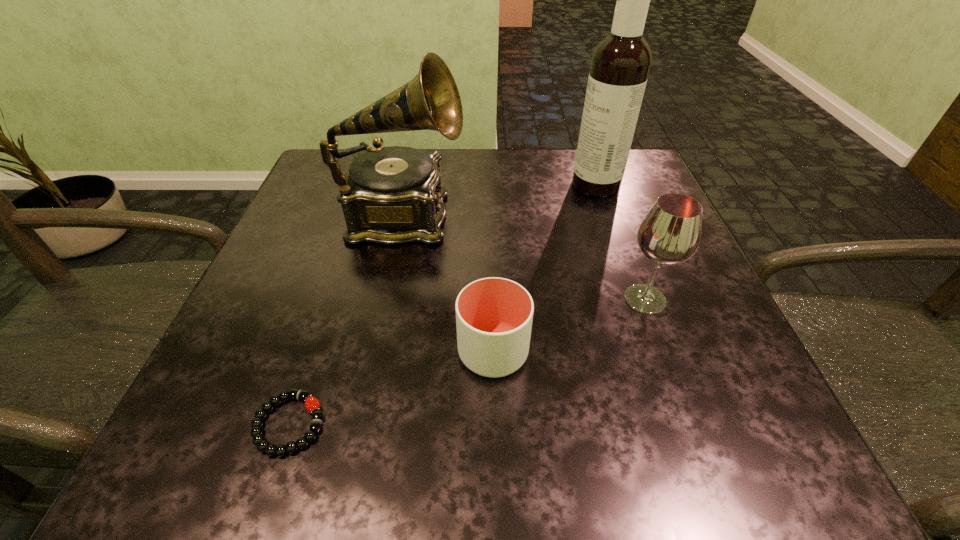
Locate an element on the screen. dishwasher detergent is located at coordinates (620, 65).

This screenshot has height=540, width=960. What are the coordinates of `phonograph record` in the screenshot? It's located at (391, 195).

Where is `the third shortest object`? The image size is (960, 540). the third shortest object is located at coordinates 670,233.

Locate an element on the screen. the third farthest object is located at coordinates (670, 233).

Identify the location of the second shortest object. (494, 316).

I want to click on the second nearest object, so click(x=494, y=316).

The height and width of the screenshot is (540, 960). What are the coordinates of `the shortest object` in the screenshot? It's located at [x=312, y=404].

This screenshot has height=540, width=960. Identify the location of the nearest object. (312, 404).

I want to click on vacant space located on the label side of the dishwasher detergent, so click(469, 185).

The height and width of the screenshot is (540, 960). Identify the location of free space located 0.150m on the label side of the dishwasher detergent. (505, 185).